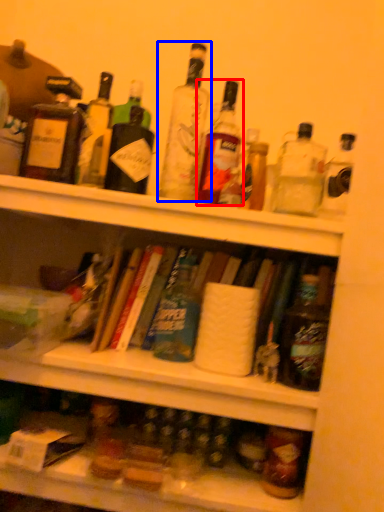
Question: Which of the following is the farthest to the observer, bottle (highlighted by a red box) or bottle (highlighted by a blue box)?

Choices:
 (A) bottle
 (B) bottle

Answer: (A)